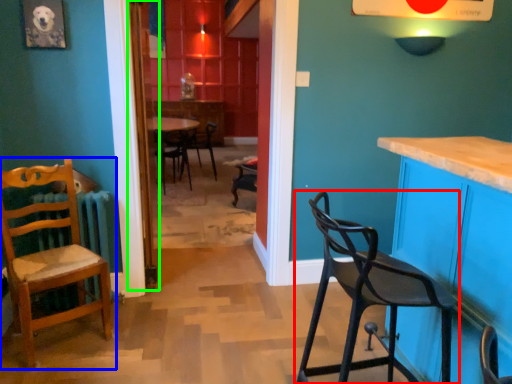
Question: Which object is positioned closest to chair (highlighted by a red box)? Select from chair (highlighted by a blue box) and door (highlighted by a green box).

Choices:
 (A) chair
 (B) door

Answer: (A)